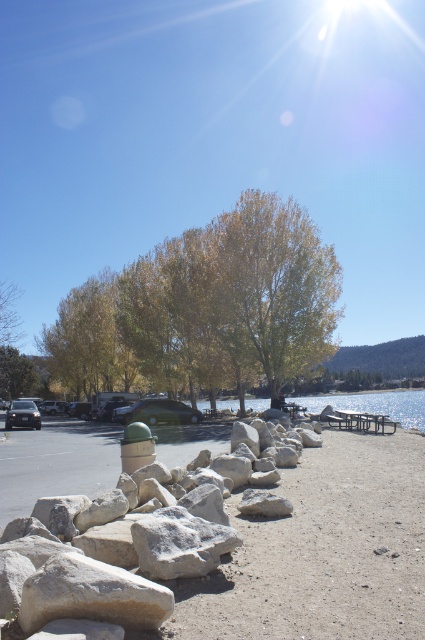
Who is lower down, golden textured tree at center or green matte hydrant at center?

green matte hydrant at center

Between point (187, 310) and point (124, 470), which one is positioned behind?

The point (187, 310) is more distant.

You are a GUI agent. You are given a task and a screenshot of the screen. Output one action in this format:
    pyautogui.click(x=<x>, y=<y>)
    Task: Click on the golden textured tree at center
    The width and height of the screenshot is (425, 640).
    Given the screenshot: What is the action you would take?
    pyautogui.click(x=207, y=307)

Is gray rough stone at lower left closer to the viewer compared to green matte hydrant at center?

That is True.

What do you see at coordinates (56, 461) in the screenshot? I see `gray rough stone at lower left` at bounding box center [56, 461].

Does point (16, 504) lie behind point (150, 448)?

Yes, point (16, 504) is behind point (150, 448).

Find the location of `gray rough stone at lower left`. gray rough stone at lower left is located at coordinates (56, 461).

Does green matte hydrant at center come in front of metallic silver picnic table at center?

That is True.

Consider the image. Does green matte hydrant at center appear under metallic silver picnic table at center?

No.

Locate an element on the screen. green matte hydrant at center is located at coordinates (136, 445).